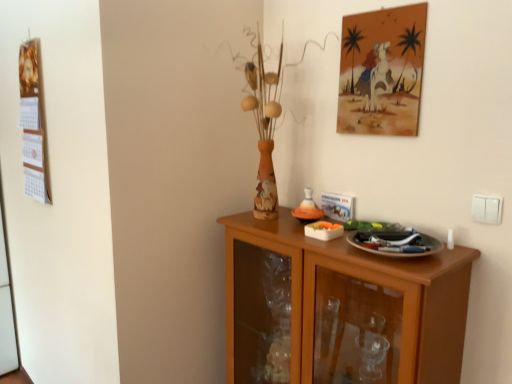
Describe the element at coordinates (33, 123) in the screenshot. This screenshot has height=384, width=512. I see `wooden calendar at left` at that location.

Where is `wooden cabinet at lower right`? The width and height of the screenshot is (512, 384). wooden cabinet at lower right is located at coordinates (339, 308).

Image resolution: width=512 pixels, height=384 pixels. I want to click on white plastic switch at right, so click(487, 209).

From the image's perspective, which is below, watercolor painting at upper right or wooden cabinet at lower right?

From the image's view, wooden cabinet at lower right is below.

Which of these two, watercolor painting at upper right or wooden cabinet at lower right, is thinner?

Thinner between the two is watercolor painting at upper right.

Considering the sizes of objects watercolor painting at upper right and wooden cabinet at lower right in the image provided, who is shorter, watercolor painting at upper right or wooden cabinet at lower right?

watercolor painting at upper right.

Is point (286, 304) behind point (481, 208)?

Yes, it is behind point (481, 208).

Is wooden cabinet at lower right surrounding white plastic switch at right?

No, white plastic switch at right is not surrounded by wooden cabinet at lower right.

From the image's perspective, is wooden cabinet at lower right positioned above or below white plastic switch at right?

Clearly, from the image's perspective, wooden cabinet at lower right is below white plastic switch at right.

Would you say wooden cabinet at lower right is to the left or to the right of white plastic switch at right in the picture?

wooden cabinet at lower right is positioned on white plastic switch at right's left side.

How much distance is there between wooden cabinet at lower right and wooden calendar at left?

They are 3.88 feet apart.

Which is correct: wooden cabinet at lower right is inside wooden calendar at left, or outside of it?

wooden cabinet at lower right is spatially situated outside wooden calendar at left.

From the image's perspective, is wooden cabinet at lower right located beneath wooden calendar at left?

Yes, from the image's perspective, wooden cabinet at lower right is below wooden calendar at left.

Is wooden cabinet at lower right facing towards wooden calendar at left?

No, wooden cabinet at lower right does not turn towards wooden calendar at left.

Does wooden cabinet at lower right have a greater width compared to watercolor painting at upper right?

Yes, wooden cabinet at lower right is wider than watercolor painting at upper right.

Can you confirm if wooden cabinet at lower right is taller than watercolor painting at upper right?

Indeed, wooden cabinet at lower right has a greater height compared to watercolor painting at upper right.

How different are the orientations of wooden cabinet at lower right and watercolor painting at upper right in degrees?

wooden cabinet at lower right and watercolor painting at upper right are facing 0.00436 degrees away from each other.

Is there a large distance between wooden cabinet at lower right and watercolor painting at upper right?

No, there isn't a large distance between wooden cabinet at lower right and watercolor painting at upper right.

Between wooden calendar at left and white plastic switch at right, which one has less height?

white plastic switch at right is shorter.

Is wooden calendar at left thinner than white plastic switch at right?

No, wooden calendar at left is not thinner than white plastic switch at right.

Which point is more distant from viewer, (x=35, y=64) or (x=488, y=214)?

The point (x=35, y=64) is behind.

Which object is thinner, watercolor painting at upper right or wooden calendar at left?

watercolor painting at upper right is thinner.

Is watercolor painting at upper right next to wooden calendar at left?

No, watercolor painting at upper right is not beside wooden calendar at left.

Who is shorter, watercolor painting at upper right or wooden calendar at left?

watercolor painting at upper right.

Is wooden calendar at left completely or partially inside watercolor painting at upper right?

No, wooden calendar at left is not inside watercolor painting at upper right.

Are white plastic switch at right and watercolor painting at upper right located far from each other?

That's not correct — white plastic switch at right is a little close to watercolor painting at upper right.

Can you confirm if white plastic switch at right is positioned to the right of watercolor painting at upper right?

Correct, you'll find white plastic switch at right to the right of watercolor painting at upper right.

Find the location of `electric outlet located underneath the watercolor painting at upper right (from a real-world perspective)`. electric outlet located underneath the watercolor painting at upper right (from a real-world perspective) is located at coordinates (487, 209).

From a real-world perspective, is white plastic switch at right above or below watercolor painting at upper right?

Clearly, from a real-world perspective, white plastic switch at right is below watercolor painting at upper right.

Locate an element on the screen. This screenshot has height=384, width=512. cabinetry located on the left of watercolor painting at upper right is located at coordinates (339, 308).

What are the coordinates of `cabinetry below the white plastic switch at right (from a real-world perspective)` in the screenshot? It's located at (339, 308).

Estimate the real-world distances between objects in this image. Which object is closer to watercolor painting at upper right, wooden calendar at left or white plastic switch at right?

The object closer to watercolor painting at upper right is white plastic switch at right.

From the image, which object appears to be nearer to wooden cabinet at lower right, watercolor painting at upper right or white plastic switch at right?

white plastic switch at right.

Looking at the image, which one is located further to watercolor painting at upper right, white plastic switch at right or wooden cabinet at lower right?

wooden cabinet at lower right is positioned further to the anchor watercolor painting at upper right.

Considering their positions, is watercolor painting at upper right positioned closer to white plastic switch at right than wooden cabinet at lower right?

Among the two, watercolor painting at upper right is located nearer to white plastic switch at right.

Looking at the image, which one is located closer to wooden calendar at left, white plastic switch at right or wooden cabinet at lower right?

Among the two, wooden cabinet at lower right is located nearer to wooden calendar at left.

Consider the image. When comparing their distances from white plastic switch at right, does watercolor painting at upper right or wooden calendar at left seem further?

wooden calendar at left is positioned further to the anchor white plastic switch at right.

From the image, which object appears to be farther from white plastic switch at right, wooden cabinet at lower right or wooden calendar at left?

wooden calendar at left.

From the image, which object appears to be nearer to white plastic switch at right, wooden calendar at left or wooden cabinet at lower right?

The object closer to white plastic switch at right is wooden cabinet at lower right.

This screenshot has height=384, width=512. In order to click on cabinetry situated between wooden calendar at left and white plastic switch at right from left to right in this screenshot , I will do `click(339, 308)`.

This screenshot has width=512, height=384. I want to click on picture frame between wooden calendar at left and white plastic switch at right in the horizontal direction, so click(x=382, y=71).

Locate an element on the screen. cabinetry between wooden calendar at left and watercolor painting at upper right in the horizontal direction is located at coordinates (339, 308).

The image size is (512, 384). I want to click on electric outlet between watercolor painting at upper right and wooden cabinet at lower right from top to bottom, so click(487, 209).